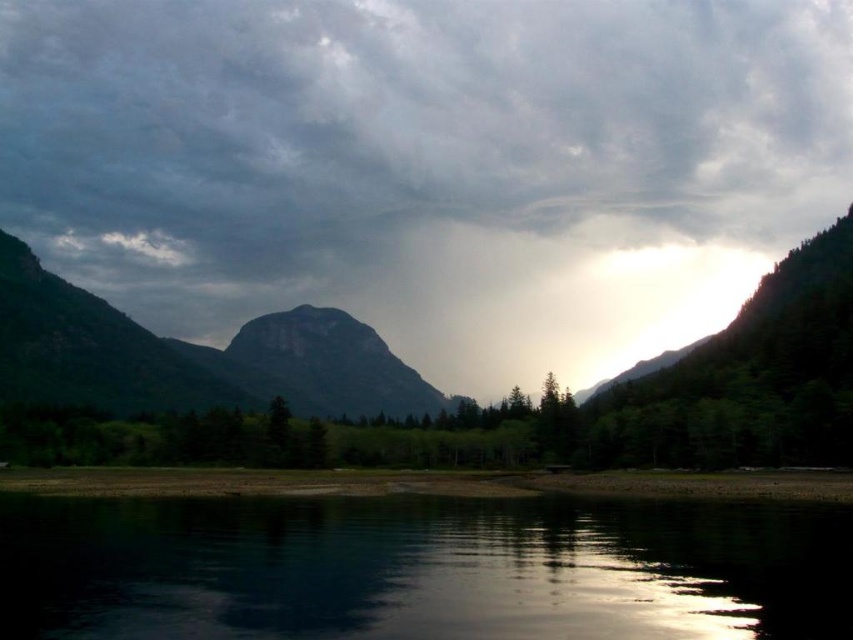
Question: Which is nearer to the black reflective water at lower center?

Choices:
 (A) rugged stone mountain at center
 (B) dark gray cloud at center

Answer: (A)

Question: Observing the image, what is the correct spatial positioning of black reflective water at lower center in reference to rugged stone mountain at center?

Choices:
 (A) right
 (B) left

Answer: (A)

Question: Can you confirm if dark gray cloud at center is thinner than black reflective water at lower center?

Choices:
 (A) yes
 (B) no

Answer: (B)

Question: Among these objects, which one is nearest to the camera?

Choices:
 (A) black reflective water at lower center
 (B) dark gray cloud at center
 (C) rugged stone mountain at center

Answer: (A)

Question: Among these objects, which one is nearest to the camera?

Choices:
 (A) dark gray cloud at center
 (B) black reflective water at lower center
 (C) rugged stone mountain at center

Answer: (B)

Question: Can you confirm if dark gray cloud at center is bigger than black reflective water at lower center?

Choices:
 (A) no
 (B) yes

Answer: (B)